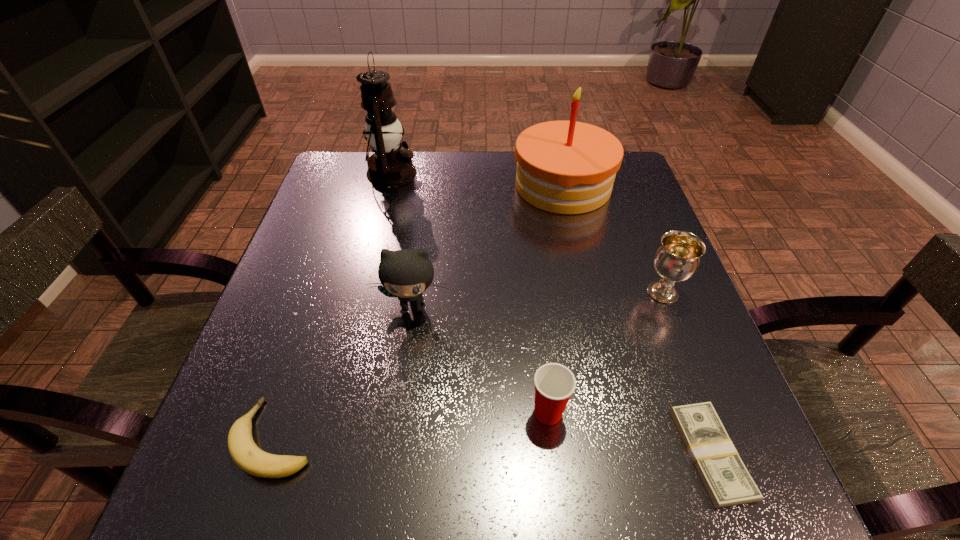
Where is `free area in between the second tallest object and the lantern`? free area in between the second tallest object and the lantern is located at coordinates (477, 179).

Where is `unoccupied position between the kitten and the Dixie cup`? This screenshot has height=540, width=960. unoccupied position between the kitten and the Dixie cup is located at coordinates (480, 360).

Locate an element on the screen. free space between the lantern and the shortest object is located at coordinates [551, 313].

Locate which object ranks third in proximity to the tallest object. Please provide its 2D coordinates. Your answer should be formatted as a tuple, i.e. [(x, y)], where the tuple contains the x and y coordinates of a point satisfying the conditions above.

[(245, 453)]

Select which object is the sixth closest to the Dixie cup. Please provide its 2D coordinates. Your answer should be formatted as a tuple, i.e. [(x, y)], where the tuple contains the x and y coordinates of a point satisfying the conditions above.

[(389, 166)]

Locate an element on the screen. The width and height of the screenshot is (960, 540). free space that satisfies the following two spatial constraints: 1. on the front-facing side of the kitten; 2. on the left side of the Dixie cup is located at coordinates (397, 413).

Where is `vacant point that satisfies the following two spatial constraints: 1. on the front-facing side of the kitten; 2. on the right side of the fifth tallest object`? The width and height of the screenshot is (960, 540). vacant point that satisfies the following two spatial constraints: 1. on the front-facing side of the kitten; 2. on the right side of the fifth tallest object is located at coordinates (397, 413).

Identify the location of free space that satisfies the following two spatial constraints: 1. on the side of the lantern, there is a wick adjustment knob; 2. on the back side of the third shortest object. This screenshot has height=540, width=960. coord(331,413).

Where is `free space that satisfies the following two spatial constraints: 1. on the side of the lantern, there is a wick adjustment knob; 2. on the back side of the shortest object`? free space that satisfies the following two spatial constraints: 1. on the side of the lantern, there is a wick adjustment knob; 2. on the back side of the shortest object is located at coordinates (322, 454).

Locate an element on the screen. The height and width of the screenshot is (540, 960). free space that satisfies the following two spatial constraints: 1. on the front-facing side of the Dixie cup; 2. on the right side of the kitten is located at coordinates [x=397, y=413].